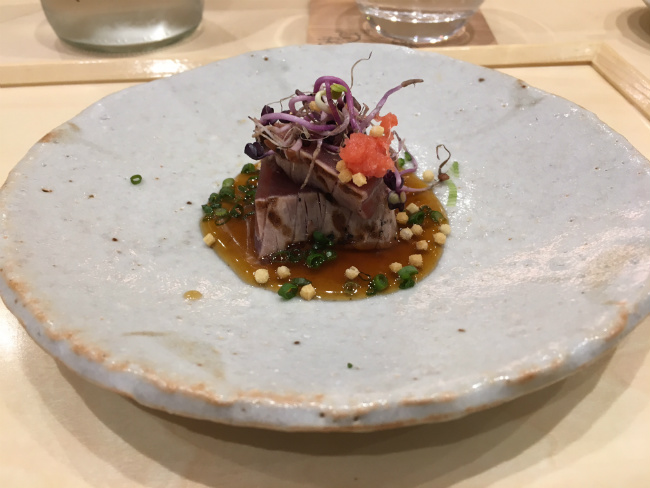
Where is `upper wooden surface`? The image size is (650, 488). upper wooden surface is located at coordinates (19, 29), (545, 26).